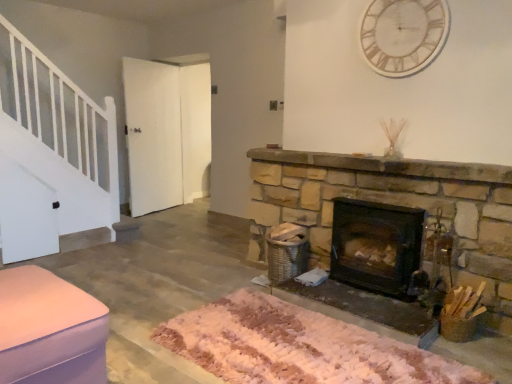
Describe the element at coordinates (298, 347) in the screenshot. Image resolution: width=512 pixels, height=384 pixels. I see `white fluffy mat at center` at that location.

Where is `white marble clock at upper center`? The height and width of the screenshot is (384, 512). white marble clock at upper center is located at coordinates (403, 35).

I want to click on pink fabric ottoman at lower left, so click(49, 329).

From a real-world perspective, relative to white fluffy mat at center, is dark brown stone wood burning stove at center right vertically above or below?

Clearly, from a real-world perspective, dark brown stone wood burning stove at center right is above white fluffy mat at center.

Can you confirm if dark brown stone wood burning stove at center right is wider than white fluffy mat at center?

In fact, dark brown stone wood burning stove at center right might be narrower than white fluffy mat at center.

Is dark brown stone wood burning stove at center right surrounding white fluffy mat at center?

No, white fluffy mat at center is not a part of dark brown stone wood burning stove at center right.

Based on their sizes in the image, would you say dark brown stone wood burning stove at center right is bigger or smaller than white fluffy mat at center?

In the image, dark brown stone wood burning stove at center right appears to be smaller than white fluffy mat at center.

Consider the image. From the image's perspective, is white fluffy mat at center over white marble clock at upper center?

Actually, white fluffy mat at center appears below white marble clock at upper center in the image.

In terms of width, does white fluffy mat at center look wider or thinner when compared to white marble clock at upper center?

Considering their sizes, white fluffy mat at center looks broader than white marble clock at upper center.

Is white fluffy mat at center facing away from white marble clock at upper center?

No, white fluffy mat at center is not facing away from white marble clock at upper center.

Who is taller, white marble clock at upper center or dark brown stone wood burning stove at center right?

With more height is dark brown stone wood burning stove at center right.

Is point (448, 33) closer or farther from the camera than point (367, 241)?

Point (448, 33) is positioned closer to the camera compared to point (367, 241).

What's the angular difference between white marble clock at upper center and dark brown stone wood burning stove at center right's facing directions?

The angle between the facing direction of white marble clock at upper center and the facing direction of dark brown stone wood burning stove at center right is 1.78 degrees.

Who is bigger, white marble clock at upper center or dark brown stone wood burning stove at center right?

Bigger between the two is dark brown stone wood burning stove at center right.

Is dark brown stone wood burning stove at center right not within white marble clock at upper center?

That's correct, dark brown stone wood burning stove at center right is outside of white marble clock at upper center.

Is dark brown stone wood burning stove at center right taller than white marble clock at upper center?

Yes, dark brown stone wood burning stove at center right is taller than white marble clock at upper center.

Where is `wood burning stove directly beneath the white marble clock at upper center (from a real-world perspective)`? Image resolution: width=512 pixels, height=384 pixels. wood burning stove directly beneath the white marble clock at upper center (from a real-world perspective) is located at coordinates (376, 246).

Can you confirm if dark brown stone wood burning stove at center right is bigger than white marble clock at upper center?

Correct, dark brown stone wood burning stove at center right is larger in size than white marble clock at upper center.

Is white fluffy mat at center facing away from pink fabric ottoman at lower left?

white fluffy mat at center is not turned away from pink fabric ottoman at lower left.

Which is less distant, (387,359) or (85,299)?

Point (387,359) is positioned farther from the camera compared to point (85,299).

You are a GUI agent. You are given a task and a screenshot of the screen. Output one action in this format:
    pyautogui.click(x=<x>, y=<y>)
    Task: Click on the mat to the right of pink fabric ottoman at lower left
    This screenshot has width=512, height=384.
    Given the screenshot: What is the action you would take?
    pyautogui.click(x=298, y=347)

From the picture: What's the angular difference between white fluffy mat at center and pink fabric ottoman at lower left's facing directions?

The angle between the facing direction of white fluffy mat at center and the facing direction of pink fabric ottoman at lower left is 180 degrees.

Which is more to the right, pink fabric ottoman at lower left or dark brown stone wood burning stove at center right?

dark brown stone wood burning stove at center right is more to the right.

Consider the image. Does pink fabric ottoman at lower left lie behind dark brown stone wood burning stove at center right?

No.

From a real-world perspective, which is physically below, pink fabric ottoman at lower left or dark brown stone wood burning stove at center right?

From a 3D spatial view, pink fabric ottoman at lower left is below.

What's the angular difference between white marble clock at upper center and white fluffy mat at center's facing directions?

The angular difference between white marble clock at upper center and white fluffy mat at center is 0.534 degrees.

Is there a large distance between white marble clock at upper center and white fluffy mat at center?

Yes.

Does point (444, 27) appear closer or farther from the camera than point (199, 348)?

Point (444, 27) appears to be farther away from the viewer than point (199, 348).

At what (x,y) coordinates should I click in order to perform the action: click on mat on the left of white marble clock at upper center. Please return your answer as a coordinate pair (x, y). This screenshot has height=384, width=512. Looking at the image, I should click on (298, 347).

The width and height of the screenshot is (512, 384). I want to click on mat below the dark brown stone wood burning stove at center right (from the image's perspective), so click(x=298, y=347).

Find the location of a particular element. mat in front of the white marble clock at upper center is located at coordinates (298, 347).

Looking at the image, which one is located closer to dark brown stone wood burning stove at center right, pink fabric ottoman at lower left or white marble clock at upper center?

The object closer to dark brown stone wood burning stove at center right is white marble clock at upper center.

Considering their positions, is white marble clock at upper center positioned closer to white fluffy mat at center than pink fabric ottoman at lower left?

Based on the image, pink fabric ottoman at lower left appears to be nearer to white fluffy mat at center.

When comparing their distances from pink fabric ottoman at lower left, does dark brown stone wood burning stove at center right or white fluffy mat at center seem closer?

Based on the image, white fluffy mat at center appears to be nearer to pink fabric ottoman at lower left.

From the picture: Based on their spatial positions, is pink fabric ottoman at lower left or white marble clock at upper center closer to white fluffy mat at center?

pink fabric ottoman at lower left is positioned closer to the anchor white fluffy mat at center.

Looking at the image, which one is located closer to white marble clock at upper center, white fluffy mat at center or dark brown stone wood burning stove at center right?

dark brown stone wood burning stove at center right is positioned closer to the anchor white marble clock at upper center.

When comparing their distances from white fluffy mat at center, does dark brown stone wood burning stove at center right or white marble clock at upper center seem further?

Among the two, white marble clock at upper center is located further to white fluffy mat at center.

Considering their positions, is pink fabric ottoman at lower left positioned further to dark brown stone wood burning stove at center right than white fluffy mat at center?

The object further to dark brown stone wood burning stove at center right is pink fabric ottoman at lower left.

Which object lies nearer to the anchor point pink fabric ottoman at lower left, white marble clock at upper center or dark brown stone wood burning stove at center right?

Among the two, dark brown stone wood burning stove at center right is located nearer to pink fabric ottoman at lower left.

Find the location of `wood burning stove between white marble clock at upper center and white fluffy mat at center in the up-down direction`. wood burning stove between white marble clock at upper center and white fluffy mat at center in the up-down direction is located at coordinates (376, 246).

Locate an element on the screen. The width and height of the screenshot is (512, 384). wood burning stove between pink fabric ottoman at lower left and white marble clock at upper center from left to right is located at coordinates (376, 246).

I want to click on furniture between white marble clock at upper center and white fluffy mat at center in the vertical direction, so click(x=49, y=329).

Identify the location of mat located between pink fabric ottoman at lower left and dark brown stone wood burning stove at center right in the left-right direction. Image resolution: width=512 pixels, height=384 pixels. (298, 347).